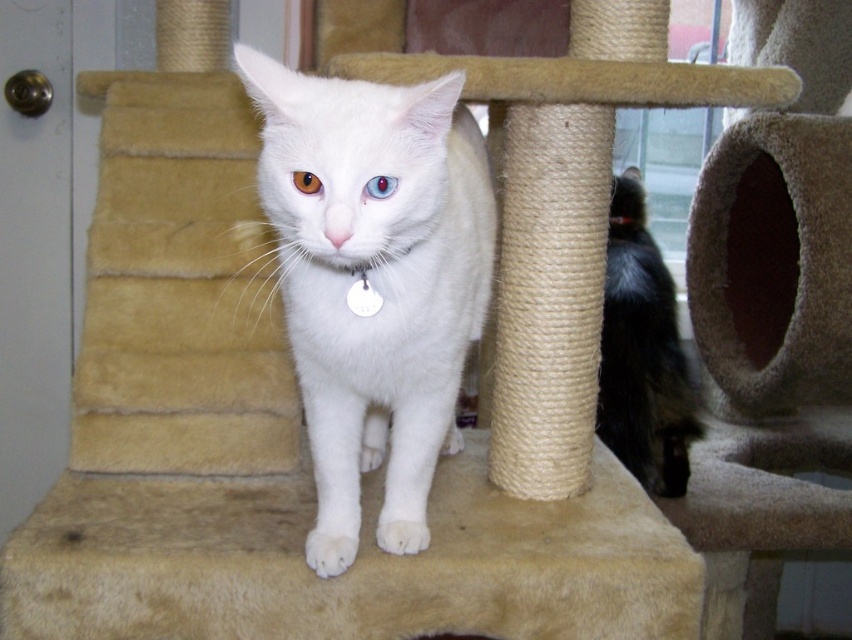
Can you confirm if beige carpeted cat bed at center is positioned above brown glossy eye at center?

Incorrect, beige carpeted cat bed at center is not positioned above brown glossy eye at center.

Describe the element at coordinates (275, 448) in the screenshot. This screenshot has width=852, height=640. I see `beige carpeted cat bed at center` at that location.

The height and width of the screenshot is (640, 852). I want to click on beige carpeted cat bed at center, so click(x=275, y=448).

Is white fur cat at center shorter than blue glossy eye at center?

No, white fur cat at center is not shorter than blue glossy eye at center.

What do you see at coordinates (373, 282) in the screenshot? This screenshot has height=640, width=852. I see `white fur cat at center` at bounding box center [373, 282].

At what (x,y) coordinates should I click in order to perform the action: click on white fur cat at center. Please return your answer as a coordinate pair (x, y). Looking at the image, I should click on (373, 282).

This screenshot has width=852, height=640. Find the location of `beige carpeted cat bed at center`. beige carpeted cat bed at center is located at coordinates (275, 448).

Is point (239, 612) positioned behind point (655, 353)?

No, (239, 612) is closer to viewer.

Based on the photo, measure the distance between beige carpeted cat bed at center and camera.

beige carpeted cat bed at center is 1.24 meters away from camera.

Find the location of a particular element. The width and height of the screenshot is (852, 640). beige carpeted cat bed at center is located at coordinates (275, 448).